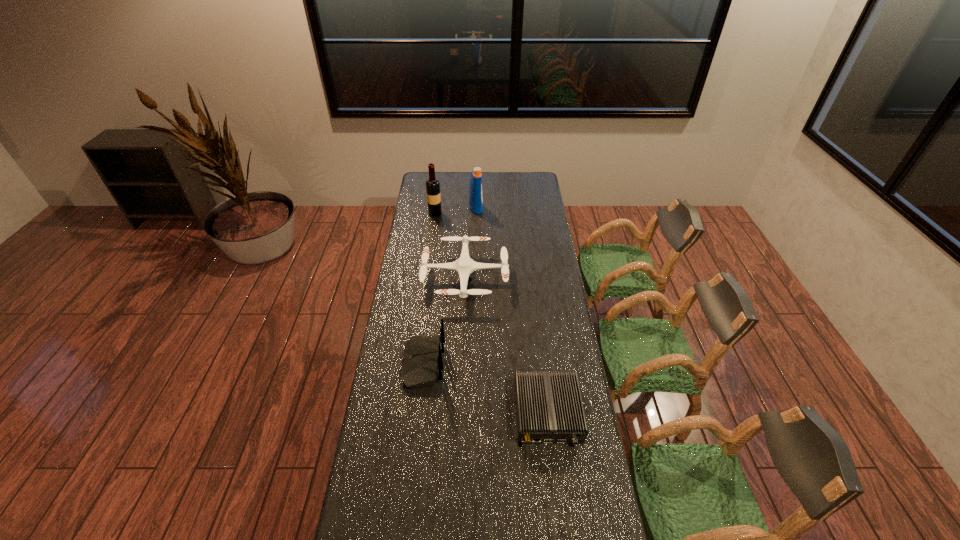
This screenshot has width=960, height=540. Identify the location of free point at the far right corner. (533, 174).

The height and width of the screenshot is (540, 960). I want to click on unoccupied position between the drone and the wine bottle, so click(x=450, y=246).

This screenshot has width=960, height=540. Find the location of `vacant area that lies between the third farthest object and the shortest object`. vacant area that lies between the third farthest object and the shortest object is located at coordinates pos(506,346).

Find the location of a particular element. This screenshot has height=540, width=960. empty space that is in between the detergent and the wine bottle is located at coordinates (455, 211).

At what (x,y) coordinates should I click in order to perform the action: click on free space between the wine bottle and the third farthest object. Please return your answer as a coordinate pair (x, y). The image size is (960, 540). Looking at the image, I should click on (450, 246).

Find the location of a particular element. This screenshot has height=540, width=960. empty location between the third shortest object and the wine bottle is located at coordinates (429, 288).

Identify the location of free spot between the second shortest object and the third shortest object. Image resolution: width=960 pixels, height=540 pixels. (444, 321).

The image size is (960, 540). Find the location of `unoccupied position between the taller router and the third nearest object`. unoccupied position between the taller router and the third nearest object is located at coordinates (444, 321).

Find the location of a particular element. The width and height of the screenshot is (960, 540). vacant space that's between the wine bottle and the third nearest object is located at coordinates (450, 246).

Identify which object is the third nearest to the detergent. Please provide its 2D coordinates. Your answer should be formatted as a tuple, i.e. [(x, y)], where the tuple contains the x and y coordinates of a point satisfying the conditions above.

[(422, 365)]